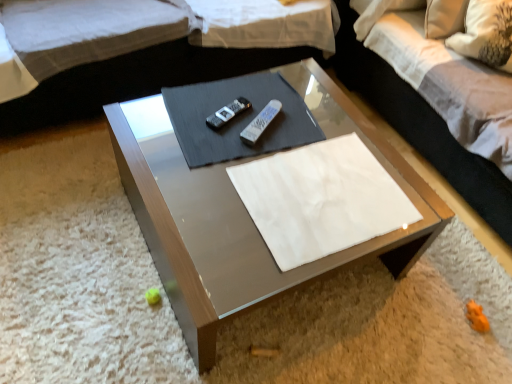
Question: In terms of width, does white plastic remote at center, which is the second remote from left to right, look wider or thinner when compared to white fabric couch at upper center?

Choices:
 (A) thin
 (B) wide

Answer: (A)

Question: From their relative heights in the image, would you say white plastic remote at center, which is the second remote from left to right, is taller or shorter than white fabric couch at upper center?

Choices:
 (A) tall
 (B) short

Answer: (B)

Question: Which is farther from the black plastic remote at center, arranged as the second remote when viewed from the right?

Choices:
 (A) white plastic remote at center, acting as the 1th remote starting from the right
 (B) white fabric pillow at upper right
 (C) metallic glass coffee table at center
 (D) white fabric couch at upper center
 (E) white fabric pillow at upper right

Answer: (B)

Question: Based on their relative distances, which object is nearer to the white fabric couch at upper center?

Choices:
 (A) white plastic remote at center, acting as the 1th remote starting from the right
 (B) metallic glass coffee table at center
 (C) white paper at center
 (D) white fabric pillow at upper right
 (E) white fabric pillow at upper right

Answer: (B)